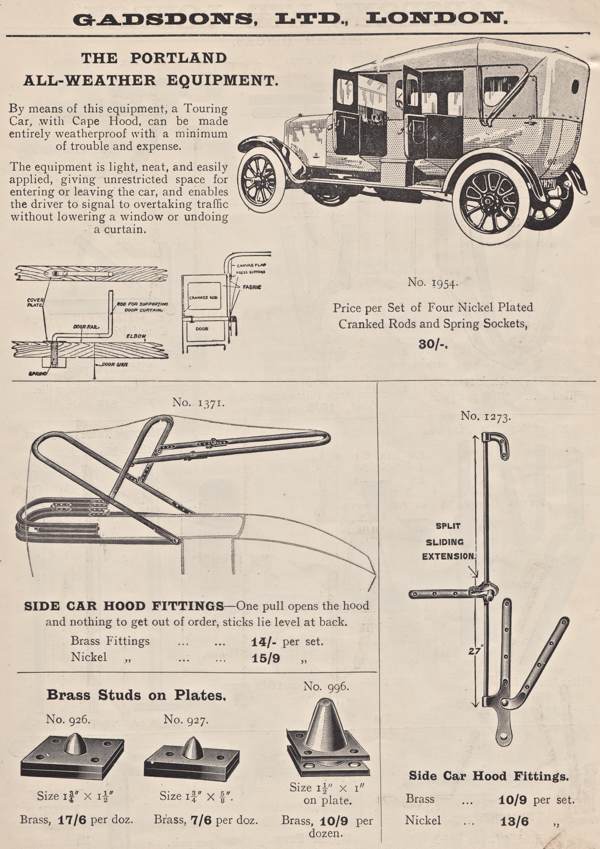
You are a GUI agent. You are given a task and a screenshot of the screen. Output one action in this format:
    pyautogui.click(x=<x>, y=<y>)
    Task: Click on the left side doors
    This screenshot has height=849, width=600.
    Given the screenshot: What is the action you would take?
    pyautogui.click(x=351, y=132), pyautogui.click(x=420, y=144)